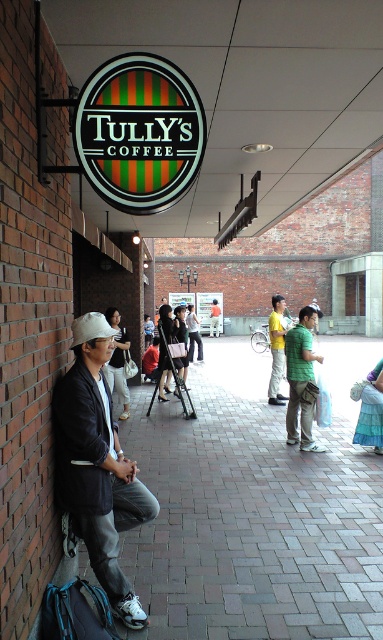
You are standing in front of the Tully Coffee shop and see the dark gray leather jacket at left and the green matte shirt at center. Which clothing item is closer to the ground?

The dark gray leather jacket at left is positioned under the green matte shirt at center, so it is closer to the ground.

You are trying to decide which item to grab quickly between the dark gray leather jacket at left and the orange shirt at center. Based on their sizes, which one would be easier to reach for a quick grab?

The dark gray leather jacket at left has a larger width than the orange shirt at center, so it would be easier to reach for a quick grab due to its bigger size.